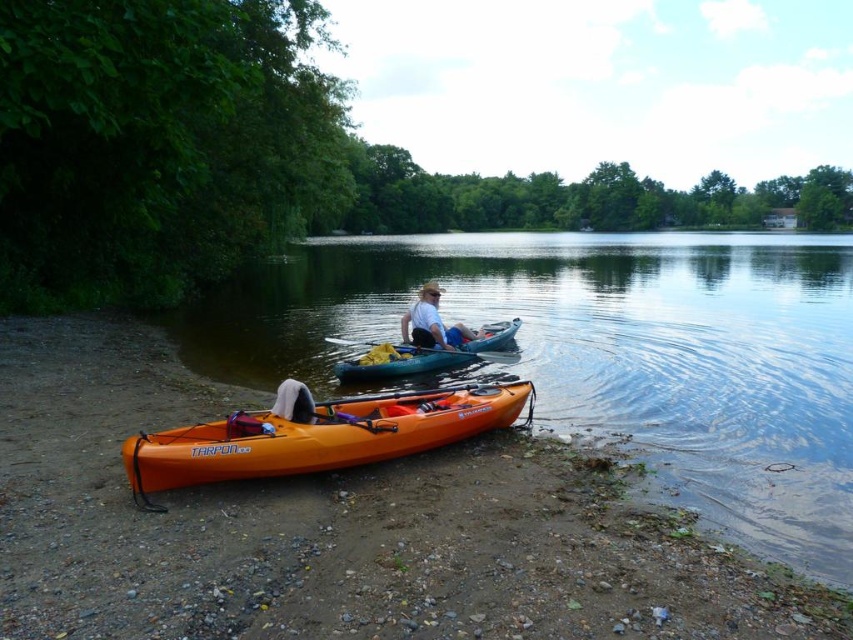
Question: Where is teal rubber kayak at center located in relation to wooden paddle at center in the image?

Choices:
 (A) right
 (B) left

Answer: (B)

Question: Among these objects, which one is farthest from the camera?

Choices:
 (A) orange matte kayak at lower left
 (B) teal rubber kayak at center

Answer: (B)

Question: Where is transparent blue water at center located in relation to orange matte kayak at lower left in the image?

Choices:
 (A) above
 (B) below

Answer: (A)

Question: Which of the following is the closest to the observer?

Choices:
 (A) matte white shirt at center
 (B) transparent blue water at center
 (C) orange matte kayak at lower left
 (D) teal rubber kayak at center

Answer: (B)

Question: Among these points, which one is farthest from the camera?

Choices:
 (A) (451, 401)
 (B) (669, 323)

Answer: (B)

Question: Is transparent blue water at center to the right of matte white shirt at center from the viewer's perspective?

Choices:
 (A) no
 (B) yes

Answer: (B)